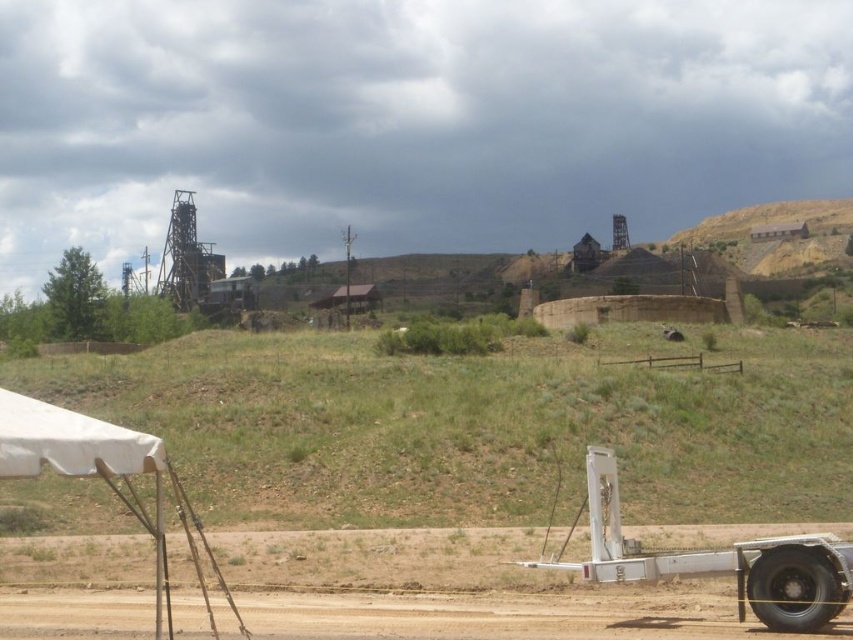
Does dirt track at lower left have a larger size compared to white metallic trailer truck at lower right?

Incorrect, dirt track at lower left is not larger than white metallic trailer truck at lower right.

The image size is (853, 640). Find the location of `dirt track at lower left`. dirt track at lower left is located at coordinates (506, 616).

Where is `white metallic trailer truck at lower right`? Image resolution: width=853 pixels, height=640 pixels. white metallic trailer truck at lower right is located at coordinates (718, 561).

Can you confirm if white metallic trailer truck at lower right is smaller than white fabric tent at lower left?

Correct, white metallic trailer truck at lower right occupies less space than white fabric tent at lower left.

Does point (581, 564) come behind point (45, 428)?

That is True.

Identify the location of white metallic trailer truck at lower right. The height and width of the screenshot is (640, 853). (718, 561).

Looking at this image, who is positioned more to the right, dirt track at lower left or white canvas canopy at lower left?

Positioned to the right is dirt track at lower left.

Does point (514, 602) come farther from viewer compared to point (108, 467)?

Yes, it is.

You are a GUI agent. You are given a task and a screenshot of the screen. Output one action in this format:
    pyautogui.click(x=<x>, y=<y>)
    Task: Click on the dirt track at lower left
    
    Given the screenshot: What is the action you would take?
    pyautogui.click(x=506, y=616)

Locate an element on the screen. dirt track at lower left is located at coordinates (506, 616).